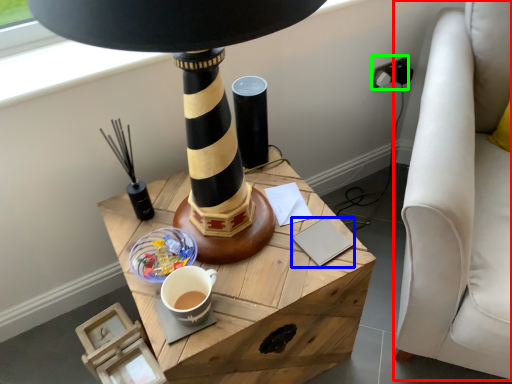
Question: Estimate the real-world distances between objects in this image. Which object is closer to swivel chair (highlighted by a red box), notepad (highlighted by a blue box) or plug (highlighted by a green box)?

Choices:
 (A) notepad
 (B) plug

Answer: (A)